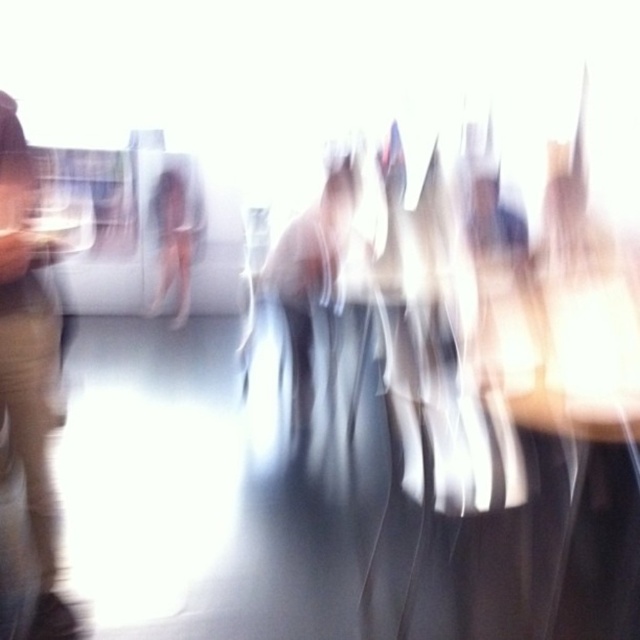
Based on the scene description, can you determine the color of the pants located at point (28, 369)?

The point (28, 369) is on light beige pants at left, so the pants there are light beige.

Based on the scene description, can you determine the spatial relationship between the light beige pants at left and the translucent white figure at center?

The light beige pants at left is positioned under the translucent white figure at center.

You are standing in a museum and see two points in the image, point (33, 413) and point (177, 307). Which point is closer to you?

Point (33, 413) is closer to the viewer than point (177, 307).